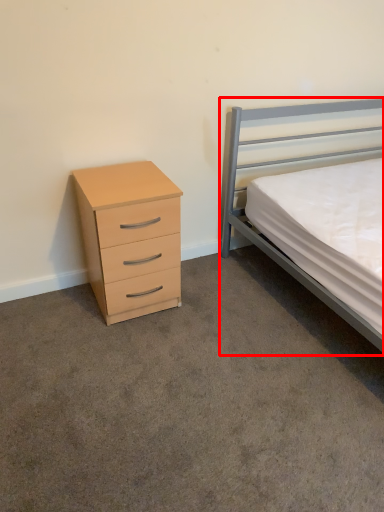
Question: From the image, what is the correct spatial relationship of bed (annotated by the red box) in relation to chest of drawers?

Choices:
 (A) left
 (B) right

Answer: (B)